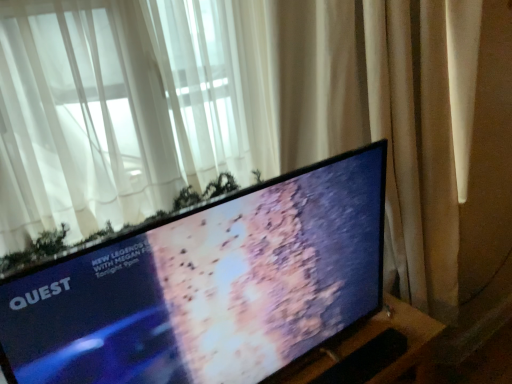
This screenshot has width=512, height=384. Find the location of `black matte keyboard at lower center`. black matte keyboard at lower center is located at coordinates (366, 360).

Measure the distance between matte black tv at center and camera.

The depth of matte black tv at center is 29.66 inches.

Identify the location of black matte keyboard at lower center. The image size is (512, 384). (366, 360).

Is matte black tv at center far away from white sheer curtain at upper left, the first curtain when ordered from left to right?

No, matte black tv at center is in close proximity to white sheer curtain at upper left, the first curtain when ordered from left to right.

Consider the image. Do you think matte black tv at center is within white sheer curtain at upper left, the first curtain when ordered from left to right, or outside of it?

matte black tv at center is spatially situated outside white sheer curtain at upper left, the first curtain when ordered from left to right.

Does point (230, 16) come behind point (478, 7)?

Yes, point (230, 16) is farther from viewer.

Considering the sizes of objects white sheer curtain at upper left, the 2th curtain viewed from the right, and beige fabric curtain at right, the second curtain in the left-to-right sequence, in the image provided, who is smaller, white sheer curtain at upper left, the 2th curtain viewed from the right, or beige fabric curtain at right, the second curtain in the left-to-right sequence,?

Smaller between the two is white sheer curtain at upper left, the 2th curtain viewed from the right.

Considering the relative sizes of white sheer curtain at upper left, the first curtain when ordered from left to right, and beige fabric curtain at right, which is the 1th curtain in right-to-left order, in the image provided, is white sheer curtain at upper left, the first curtain when ordered from left to right, wider than beige fabric curtain at right, which is the 1th curtain in right-to-left order,?

In fact, white sheer curtain at upper left, the first curtain when ordered from left to right, might be narrower than beige fabric curtain at right, which is the 1th curtain in right-to-left order.

At what (x,y) coordinates should I click in order to perform the action: click on curtain lying below the white sheer curtain at upper left, the 2th curtain viewed from the right (from the image's perspective). Please return your answer as a coordinate pair (x, y). This screenshot has height=384, width=512. Looking at the image, I should click on (388, 118).

How many degrees apart are the facing directions of white sheer curtain at upper left, the 2th curtain viewed from the right, and matte black tv at center?

They differ by 0.158 degrees in their facing directions.

The width and height of the screenshot is (512, 384). I want to click on television below the white sheer curtain at upper left, the 2th curtain viewed from the right (from a real-world perspective), so click(x=208, y=286).

From their relative heights in the image, would you say white sheer curtain at upper left, the 2th curtain viewed from the right, is taller or shorter than matte black tv at center?

Considering their sizes, white sheer curtain at upper left, the 2th curtain viewed from the right, has more height than matte black tv at center.

Does point (58, 23) come farther from viewer compared to point (371, 259)?

No, it is not.

Which of these two, black matte keyboard at lower center or beige fabric curtain at right, which is the 1th curtain in right-to-left order, is thinner?

black matte keyboard at lower center is thinner.

From the picture: Which is more to the right, black matte keyboard at lower center or beige fabric curtain at right, the second curtain in the left-to-right sequence?

From the viewer's perspective, beige fabric curtain at right, the second curtain in the left-to-right sequence, appears more on the right side.

Between black matte keyboard at lower center and beige fabric curtain at right, which is the 1th curtain in right-to-left order, which one is positioned in front?

black matte keyboard at lower center is in front.

Can you tell me how much black matte keyboard at lower center and beige fabric curtain at right, the second curtain in the left-to-right sequence, differ in facing direction?

47.8 degrees separate the facing orientations of black matte keyboard at lower center and beige fabric curtain at right, the second curtain in the left-to-right sequence.

Relative to black matte keyboard at lower center, is beige fabric curtain at right, which is the 1th curtain in right-to-left order, in front or behind?

In the image, beige fabric curtain at right, which is the 1th curtain in right-to-left order, appears behind black matte keyboard at lower center.

Looking at this image, is beige fabric curtain at right, the second curtain in the left-to-right sequence, to the left of black matte keyboard at lower center from the viewer's perspective?

No, beige fabric curtain at right, the second curtain in the left-to-right sequence, is not to the left of black matte keyboard at lower center.

Can you see beige fabric curtain at right, which is the 1th curtain in right-to-left order, touching black matte keyboard at lower center?

No, beige fabric curtain at right, which is the 1th curtain in right-to-left order, is not making contact with black matte keyboard at lower center.

Is black matte keyboard at lower center at the back of beige fabric curtain at right, which is the 1th curtain in right-to-left order?

Yes, beige fabric curtain at right, which is the 1th curtain in right-to-left order, is facing away from black matte keyboard at lower center.

Is white sheer curtain at upper left, the 2th curtain viewed from the right, facing towards black matte keyboard at lower center?

No, white sheer curtain at upper left, the 2th curtain viewed from the right, is not facing towards black matte keyboard at lower center.

Is point (49, 28) closer or farther from the camera than point (394, 359)?

Point (49, 28) is closer to the camera than point (394, 359).

From a real-world perspective, is white sheer curtain at upper left, the first curtain when ordered from left to right, on top of black matte keyboard at lower center?

Yes, from a real-world perspective, white sheer curtain at upper left, the first curtain when ordered from left to right, is on top of black matte keyboard at lower center.

Considering their positions, is white sheer curtain at upper left, the first curtain when ordered from left to right, located in front of or behind black matte keyboard at lower center?

In the image, white sheer curtain at upper left, the first curtain when ordered from left to right, appears in front of black matte keyboard at lower center.

Is beige fabric curtain at right, which is the 1th curtain in right-to-left order, smaller than matte black tv at center?

No, beige fabric curtain at right, which is the 1th curtain in right-to-left order, is not smaller than matte black tv at center.

Choose the correct answer: Is beige fabric curtain at right, which is the 1th curtain in right-to-left order, inside matte black tv at center or outside it?

beige fabric curtain at right, which is the 1th curtain in right-to-left order, cannot be found inside matte black tv at center.

How different are the orientations of beige fabric curtain at right, the second curtain in the left-to-right sequence, and matte black tv at center in degrees?

beige fabric curtain at right, the second curtain in the left-to-right sequence, and matte black tv at center are facing 48.7 degrees away from each other.

Considering the relative positions of beige fabric curtain at right, which is the 1th curtain in right-to-left order, and matte black tv at center in the image provided, is beige fabric curtain at right, which is the 1th curtain in right-to-left order, behind matte black tv at center?

Yes, beige fabric curtain at right, which is the 1th curtain in right-to-left order, is further from the viewer.

This screenshot has width=512, height=384. In order to click on curtain above the matte black tv at center (from a real-world perspective) in this screenshot , I will do `click(112, 111)`.

Where is `curtain on the left of beige fabric curtain at right, which is the 1th curtain in right-to-left order`? curtain on the left of beige fabric curtain at right, which is the 1th curtain in right-to-left order is located at coordinates (112, 111).

Which object lies further to the anchor point matte black tv at center, black matte keyboard at lower center or beige fabric curtain at right, which is the 1th curtain in right-to-left order?

beige fabric curtain at right, which is the 1th curtain in right-to-left order, is positioned further to the anchor matte black tv at center.

Which object lies further to the anchor point matte black tv at center, beige fabric curtain at right, which is the 1th curtain in right-to-left order, or black matte keyboard at lower center?

beige fabric curtain at right, which is the 1th curtain in right-to-left order, lies further to matte black tv at center than the other object.

When comparing their distances from beige fabric curtain at right, the second curtain in the left-to-right sequence, does black matte keyboard at lower center or white sheer curtain at upper left, the first curtain when ordered from left to right, seem closer?

Among the two, white sheer curtain at upper left, the first curtain when ordered from left to right, is located nearer to beige fabric curtain at right, the second curtain in the left-to-right sequence.

When comparing their distances from matte black tv at center, does white sheer curtain at upper left, the 2th curtain viewed from the right, or black matte keyboard at lower center seem closer?

black matte keyboard at lower center is positioned closer to the anchor matte black tv at center.

From the image, which object appears to be farther from white sheer curtain at upper left, the 2th curtain viewed from the right, beige fabric curtain at right, the second curtain in the left-to-right sequence, or black matte keyboard at lower center?

black matte keyboard at lower center lies further to white sheer curtain at upper left, the 2th curtain viewed from the right, than the other object.

Looking at the image, which one is located further to beige fabric curtain at right, which is the 1th curtain in right-to-left order, white sheer curtain at upper left, the first curtain when ordered from left to right, or black matte keyboard at lower center?

black matte keyboard at lower center.

Estimate the real-world distances between objects in this image. Which object is closer to black matte keyboard at lower center, matte black tv at center or white sheer curtain at upper left, the 2th curtain viewed from the right?

matte black tv at center lies closer to black matte keyboard at lower center than the other object.

Consider the image. Considering their positions, is matte black tv at center positioned further to black matte keyboard at lower center than beige fabric curtain at right, the second curtain in the left-to-right sequence?

The object further to black matte keyboard at lower center is beige fabric curtain at right, the second curtain in the left-to-right sequence.

The image size is (512, 384). Find the location of `laptop keyboard located between white sheer curtain at upper left, the 2th curtain viewed from the right, and beige fabric curtain at right, the second curtain in the left-to-right sequence, in the left-right direction`. laptop keyboard located between white sheer curtain at upper left, the 2th curtain viewed from the right, and beige fabric curtain at right, the second curtain in the left-to-right sequence, in the left-right direction is located at coordinates (366, 360).

At what (x,y) coordinates should I click in order to perform the action: click on laptop keyboard between matte black tv at center and beige fabric curtain at right, which is the 1th curtain in right-to-left order, from front to back. Please return your answer as a coordinate pair (x, y). Looking at the image, I should click on coord(366,360).

Where is `television between white sheer curtain at upper left, the first curtain when ordered from left to right, and beige fabric curtain at right, the second curtain in the left-to-right sequence, from left to right`? television between white sheer curtain at upper left, the first curtain when ordered from left to right, and beige fabric curtain at right, the second curtain in the left-to-right sequence, from left to right is located at coordinates (208, 286).

Find the location of a particular element. The image size is (512, 384). television that lies between white sheer curtain at upper left, the first curtain when ordered from left to right, and black matte keyboard at lower center from top to bottom is located at coordinates (208, 286).